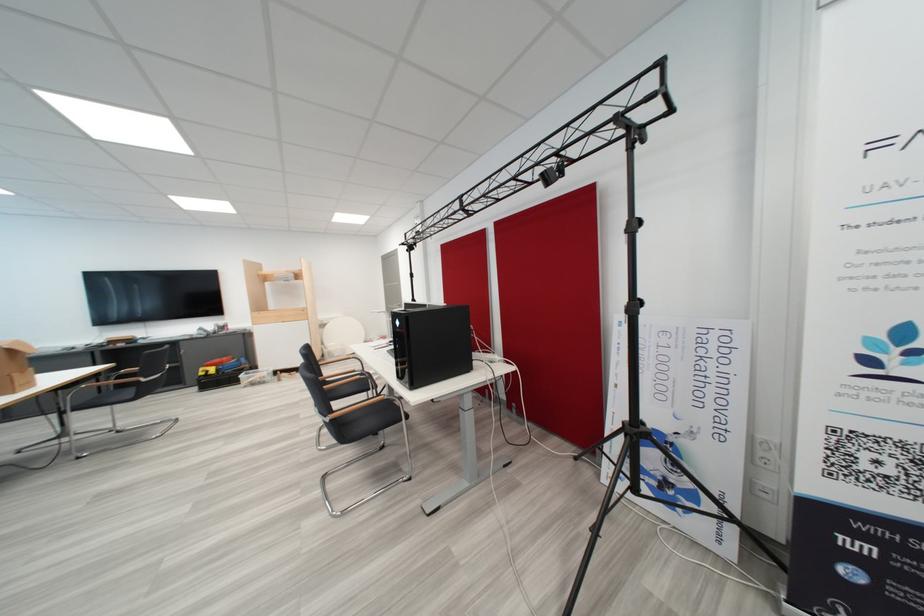
Identify the location of stand adjustment knob. (633, 225).